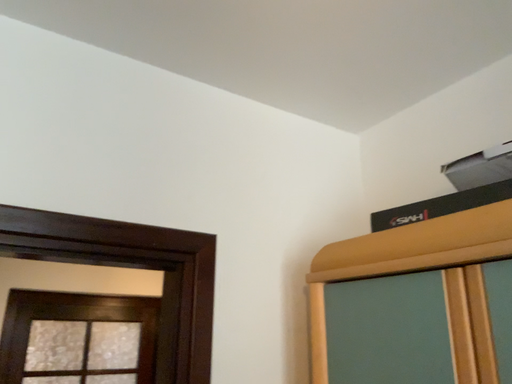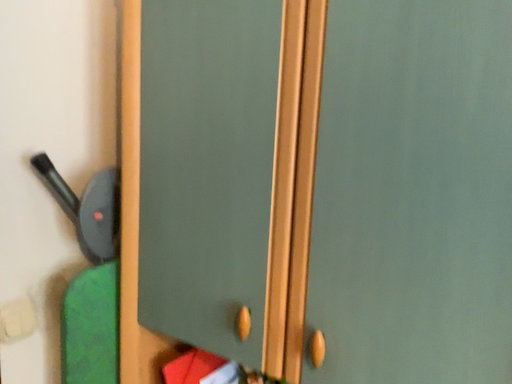
Question: Which way did the camera rotate in the video?

Choices:
 (A) rotated downward
 (B) rotated upward

Answer: (A)